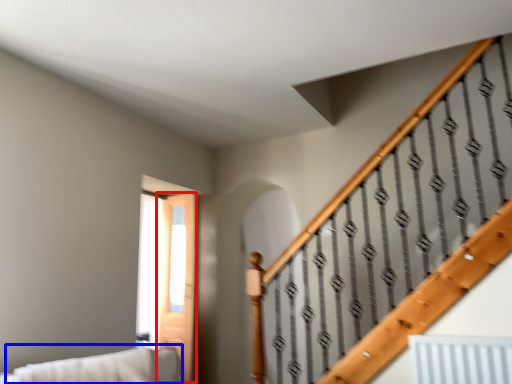
Question: Which object appears closest to the camera in this image, screen door (highlighted by a red box) or couch (highlighted by a blue box)?

Choices:
 (A) screen door
 (B) couch

Answer: (B)